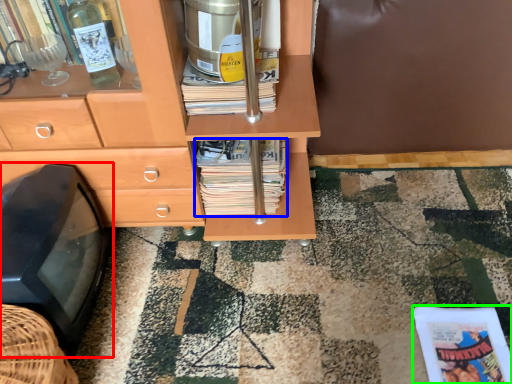
Question: Which is farther away from flat (highlighted by a red box)? magazine (highlighted by a blue box) or paperback book (highlighted by a green box)?

Choices:
 (A) magazine
 (B) paperback book

Answer: (B)